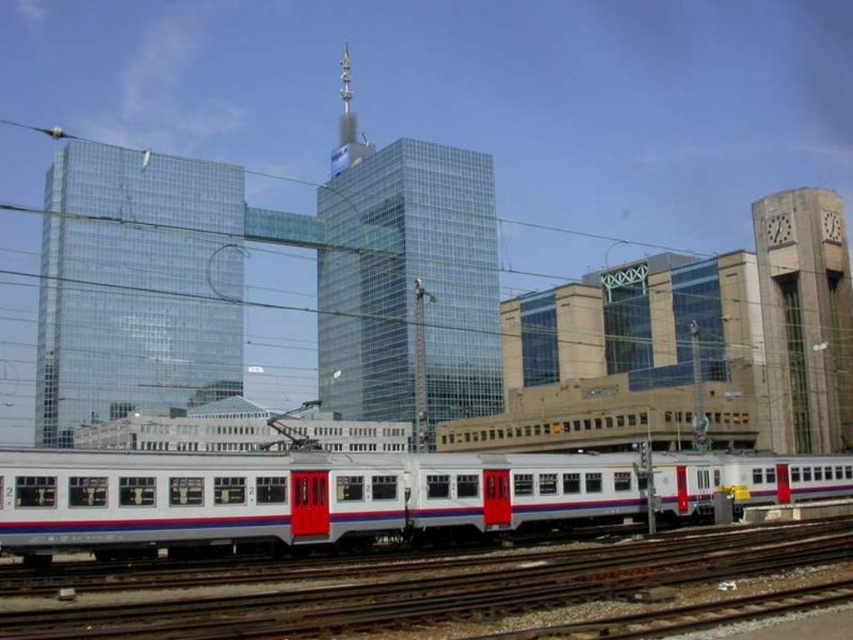
You are a drone operator preparing to fly a drone with a 1.2 meter wingspan. You are positioned at the camera location and want to fly the drone towards the white metallic train at lower center. Considering the distance between you and the train, is there enough space for the drone to fly without any obstacles?

The distance between the white metallic train at lower center and the camera is 36.52 meters, which is sufficient space for the drone to fly safely without any obstacles, as the drone only requires a minimum of 1.2 meters of clearance for its wingspan.

You are standing at the train station looking at the modern glass building. There are two points marked on the building facade at coordinates point (595, 477) and point (498, 588). Which point is closer to you?

Point (498, 588) is closer to you because it is less further to the camera than point (595, 477).

You are a city planner assessing the train station layout. The white metallic train at lower center and the metallic track at lower center are both critical components. Based on their sizes, which one is more likely to require additional space for maintenance or expansion?

The white metallic train at lower center is bigger than the metallic track at lower center, so it would likely require more space for maintenance or expansion.